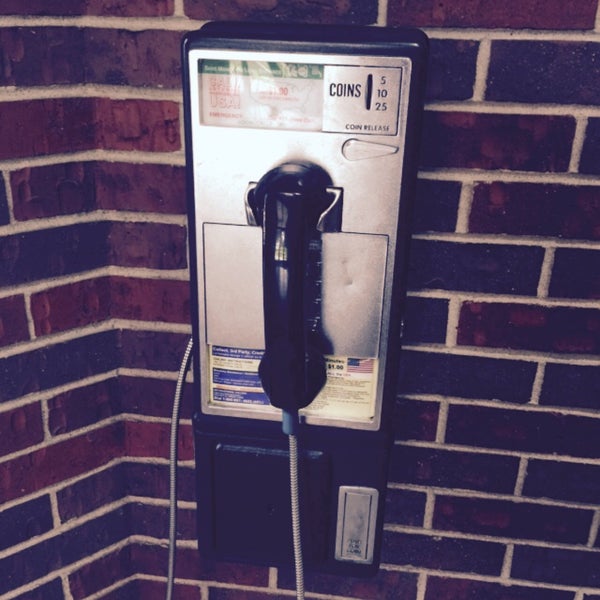
Locate an element on the screen. This screenshot has height=600, width=600. brick wall is located at coordinates (482, 132).